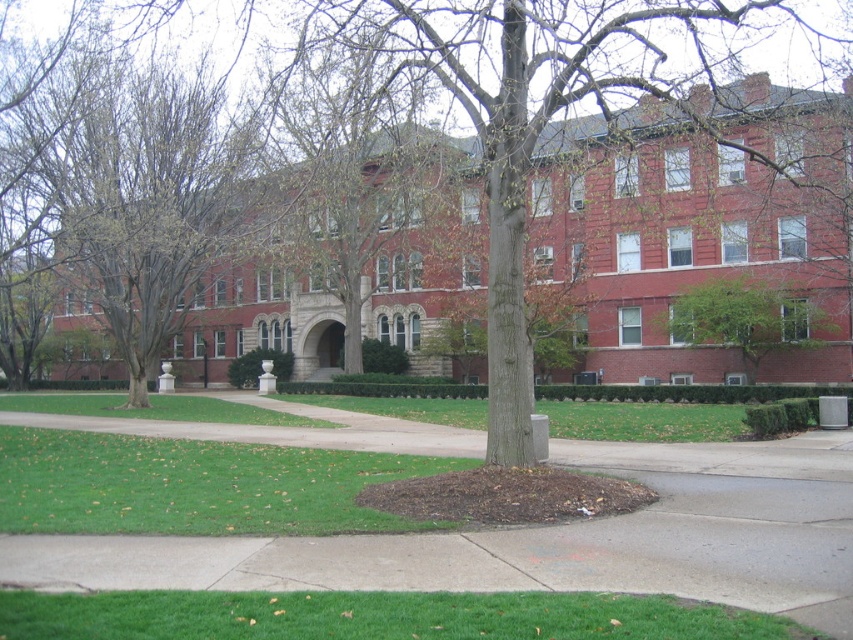
Question: Which object appears farthest from the camera in this image?

Choices:
 (A) concrete at center
 (B) green leafy tree at center
 (C) green grass at lower center

Answer: (B)

Question: Among these points, which one is farthest from the camera?

Choices:
 (A) (685, 508)
 (B) (368, 632)

Answer: (A)

Question: Does green grass at lower left appear on the right side of green grass at lower center?

Choices:
 (A) yes
 (B) no

Answer: (B)

Question: Is green grass at lower center wider than green grass at center?

Choices:
 (A) yes
 (B) no

Answer: (B)

Question: Can you confirm if brown textured tree at center is thinner than green leafy tree at center?

Choices:
 (A) no
 (B) yes

Answer: (A)

Question: Which object is closer to the camera taking this photo?

Choices:
 (A) concrete at center
 (B) brown textured tree at center

Answer: (A)